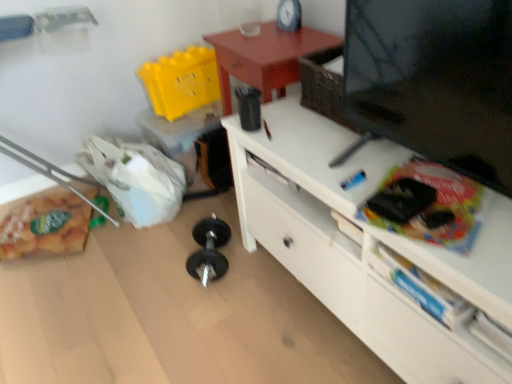
Question: Considering the positions of black matte tv at upper right and translucent plastic bag at lower left in the image, is black matte tv at upper right wider or thinner than translucent plastic bag at lower left?

Choices:
 (A) wide
 (B) thin

Answer: (B)

Question: Relative to translucent plastic bag at lower left, is black matte tv at upper right in front or behind?

Choices:
 (A) front
 (B) behind

Answer: (A)

Question: Estimate the real-world distances between objects in this image. Which object is farther from the translucent plastic bag at lower left?

Choices:
 (A) black matte tv at upper right
 (B) matte black clock at upper center
 (C) white matte drawer at lower right

Answer: (C)

Question: Based on their relative distances, which object is farther from the black matte tv at upper right?

Choices:
 (A) translucent plastic bag at lower left
 (B) white matte drawer at lower right
 (C) matte black clock at upper center

Answer: (A)